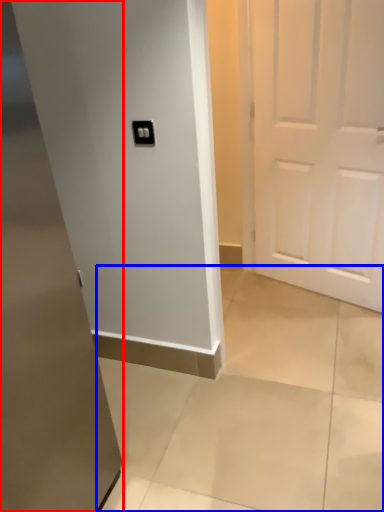
Question: Which of the following is the farthest to the observer, door (highlighted by a red box) or concrete (highlighted by a blue box)?

Choices:
 (A) door
 (B) concrete

Answer: (B)